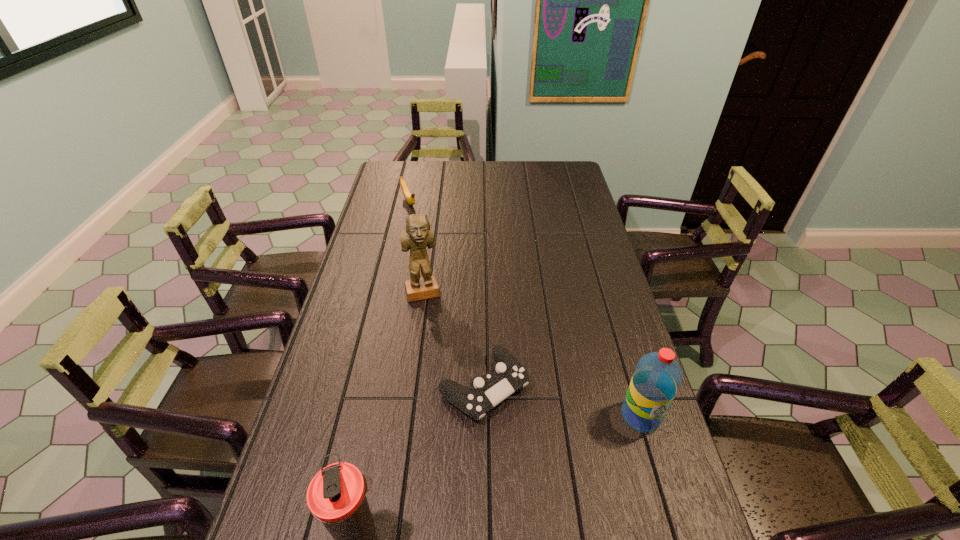
In order to click on free space on the desktop that is between the nearest object and the rightmost object and is positioned at the stem of the farthest object in this screenshot , I will do `click(552, 452)`.

You are a GUI agent. You are given a task and a screenshot of the screen. Output one action in this format:
    pyautogui.click(x=<x>, y=<y>)
    Task: Click on the vacant spot on the desktop that is between the nearest object and the water bottle and is positioned on the front-facing side of the figurine
    The image size is (960, 540).
    Given the screenshot: What is the action you would take?
    pyautogui.click(x=478, y=482)

Identify the location of free space on the desktop that is between the thermos bottle and the water bottle and is positioned on the surface of the control. pos(548,454).